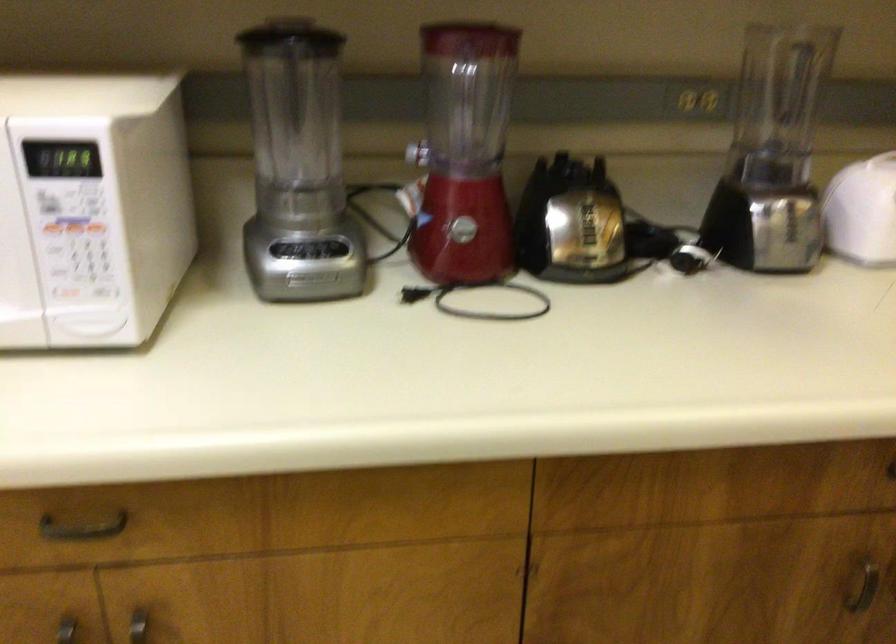
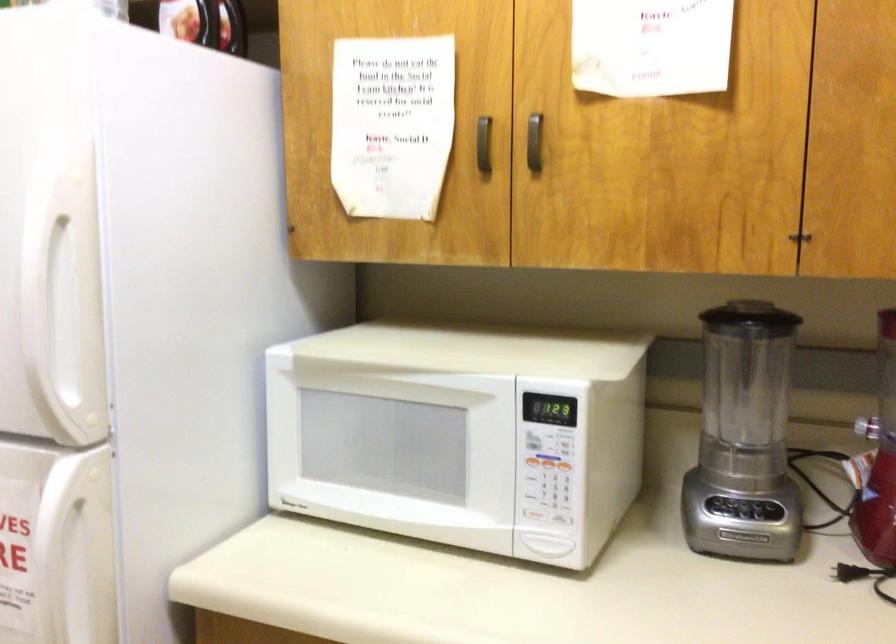
Locate, in the second image, the point that corresponds to point 332,245 in the first image.

(771, 509)